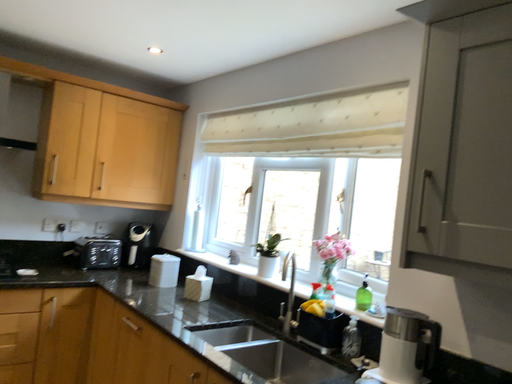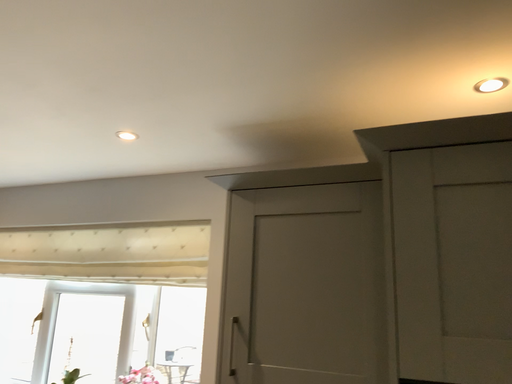
Question: How did the camera likely rotate when shooting the video?

Choices:
 (A) rotated right
 (B) rotated left

Answer: (A)